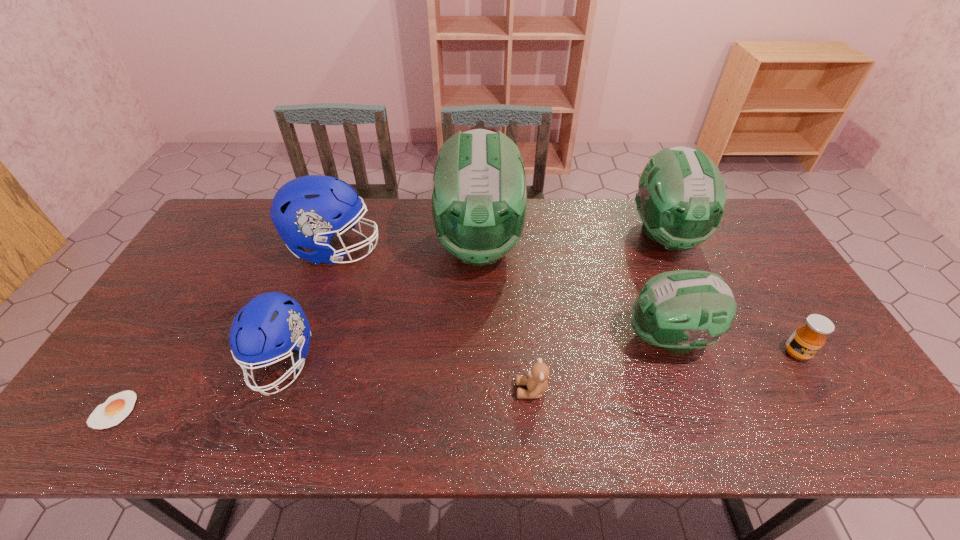
Identify the location of free region at the left edge of the desktop. (161, 310).

This screenshot has height=540, width=960. I want to click on vacant space at the right edge of the desktop, so click(779, 293).

In the image, there is a desktop. Where is `vacant region at the near right corner`? The height and width of the screenshot is (540, 960). vacant region at the near right corner is located at coordinates (859, 409).

Locate an element on the screen. vacant area between the orange honey and the smallest green football helmet is located at coordinates (732, 346).

Where is `unoccupied area between the farther blue football helmet and the orange honey`? The width and height of the screenshot is (960, 540). unoccupied area between the farther blue football helmet and the orange honey is located at coordinates (565, 301).

Find the location of `empty space that is in between the second smallest green football helmet and the shortest object`. empty space that is in between the second smallest green football helmet and the shortest object is located at coordinates (390, 323).

The height and width of the screenshot is (540, 960). Find the location of `free point between the honey and the second shortest object`. free point between the honey and the second shortest object is located at coordinates (664, 372).

Find the location of a particular element. This screenshot has width=960, height=540. free space between the nearest green football helmet and the sixth tallest object is located at coordinates (732, 346).

This screenshot has width=960, height=540. In order to click on vacant space that's between the bigger blue football helmet and the shortest object in this screenshot , I will do (225, 329).

Image resolution: width=960 pixels, height=540 pixels. What are the coordinates of `vacant space in between the second smallest green football helmet and the nearer blue football helmet` in the screenshot? It's located at [473, 299].